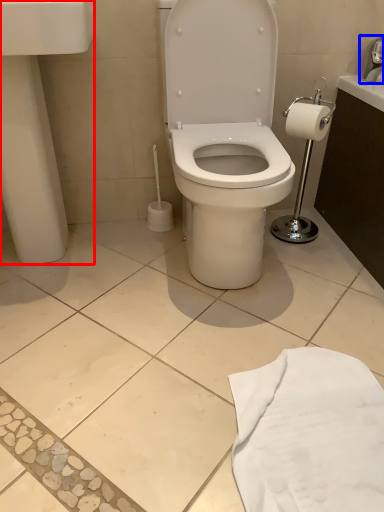
Question: Which point is further to the camera, porcelain (highlighted by a red box) or faucet (highlighted by a blue box)?

Choices:
 (A) porcelain
 (B) faucet

Answer: (B)